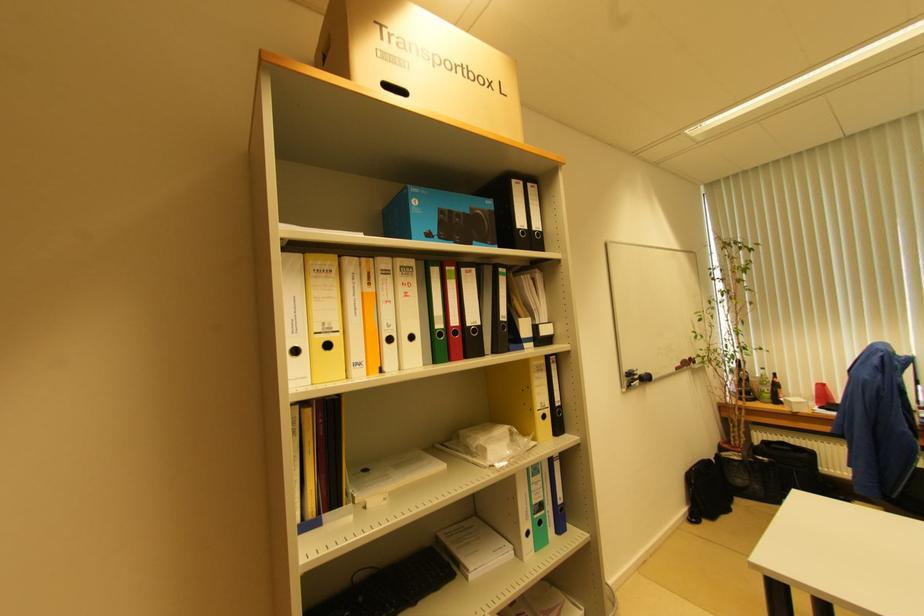
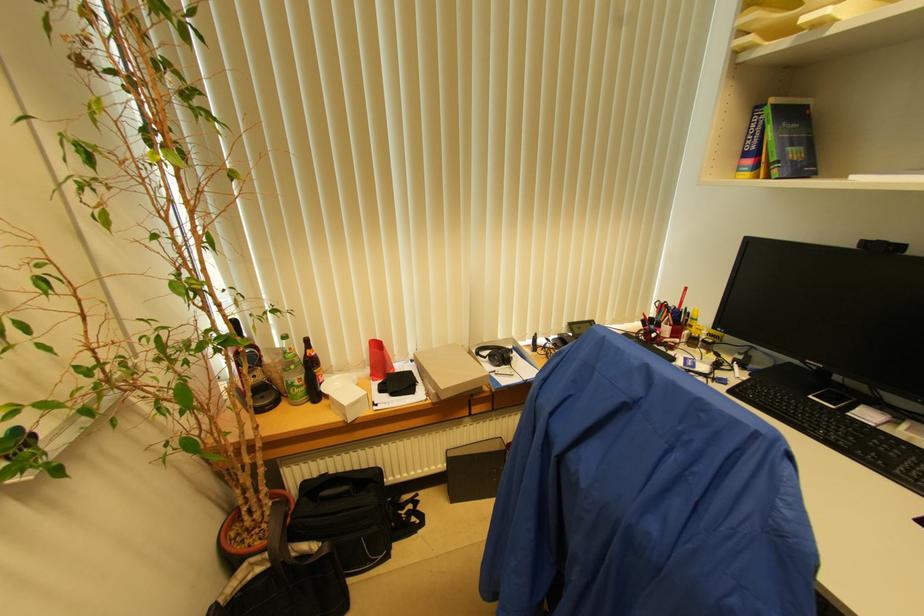
In the second image, find the point that corresponds to [772,392] in the first image.

(304, 379)